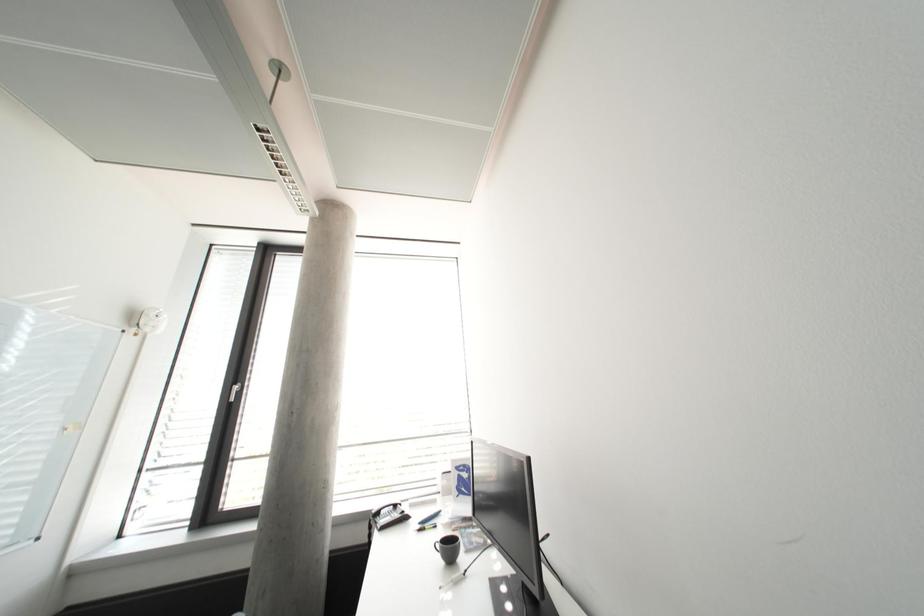
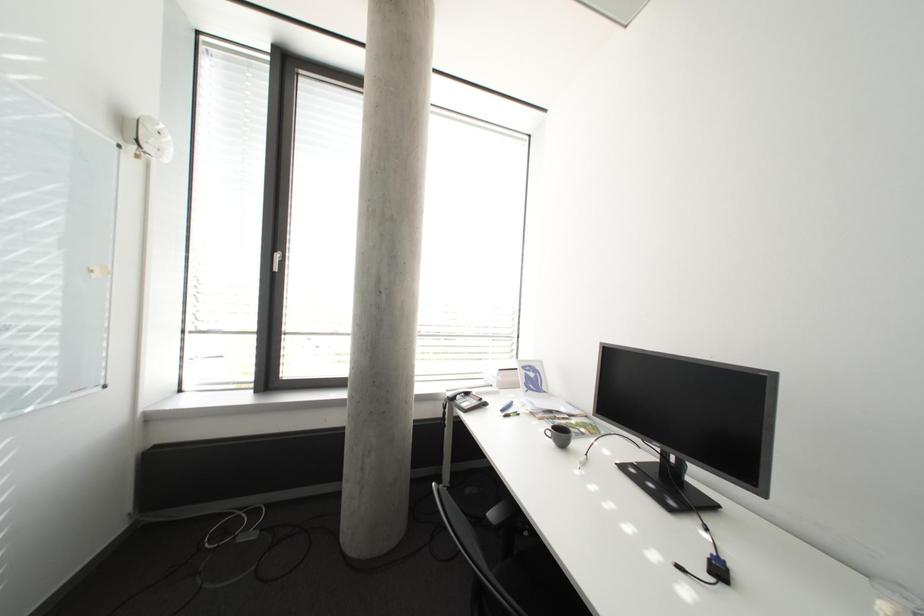
The images are taken continuously from a first-person perspective. In which direction are you moving?

The movement direction of the cameraman is left, forward.